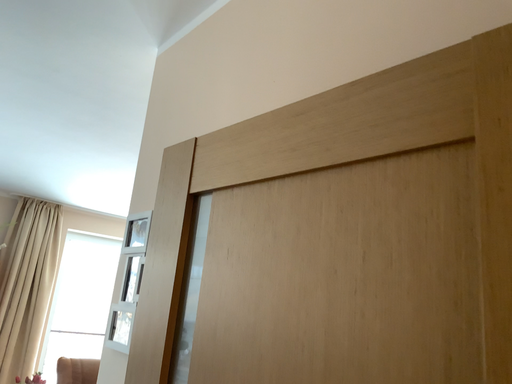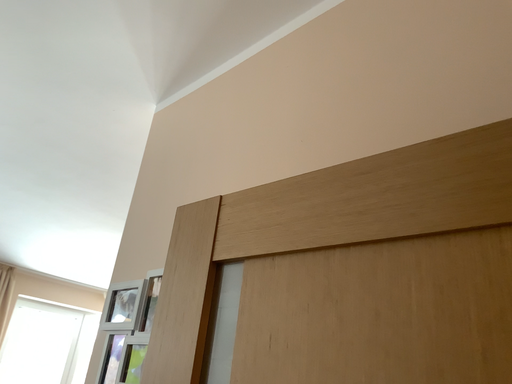
Question: Which way did the camera rotate in the video?

Choices:
 (A) rotated upward
 (B) rotated downward

Answer: (A)